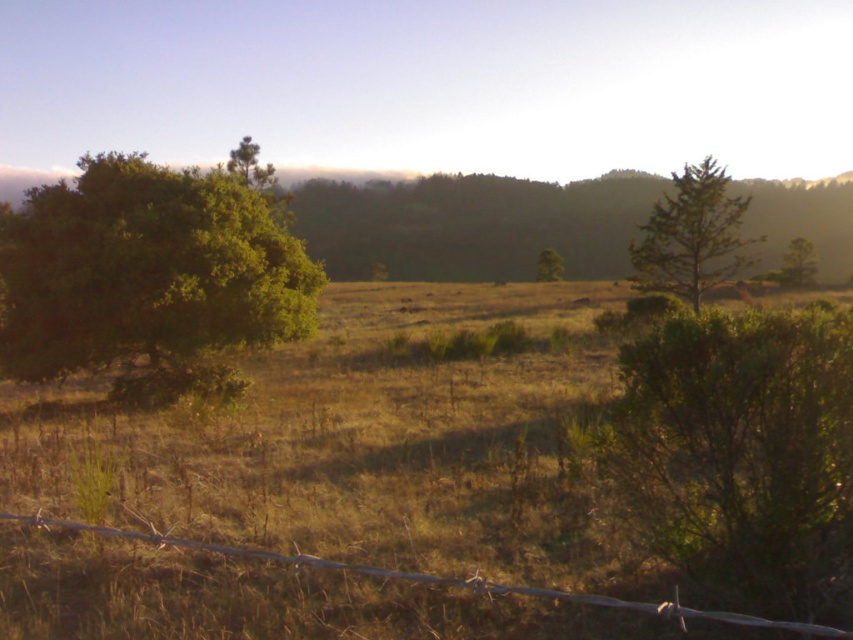
Is green leafy tree at left behind green matte tree at upper center?

No, it is in front of green matte tree at upper center.

Does green leafy tree at left appear on the left side of green matte tree at upper center?

In fact, green leafy tree at left is to the right of green matte tree at upper center.

Which is behind, point (18, 275) or point (247, 184)?

Positioned behind is point (247, 184).

Locate an element on the screen. The height and width of the screenshot is (640, 853). green leafy tree at left is located at coordinates (149, 276).

The width and height of the screenshot is (853, 640). Identify the location of green leafy tree at left. (149, 276).

Is green leafy tree at left thinner than green leafy tree at right?

Correct, green leafy tree at left's width is less than green leafy tree at right's.

Which is in front, point (204, 252) or point (799, 278)?

Point (204, 252) is in front.

Image resolution: width=853 pixels, height=640 pixels. Find the location of `green leafy tree at left`. green leafy tree at left is located at coordinates (149, 276).

Is green matte tree at upper center bigger than green leafy tree at right?

Yes, green matte tree at upper center is bigger than green leafy tree at right.

Is green matte tree at upper center thinner than green leafy tree at right?

No, green matte tree at upper center is not thinner than green leafy tree at right.

This screenshot has width=853, height=640. What are the coordinates of `green matte tree at upper center` in the screenshot? It's located at (250, 164).

The width and height of the screenshot is (853, 640). In order to click on green matte tree at upper center in this screenshot , I will do `click(250, 164)`.